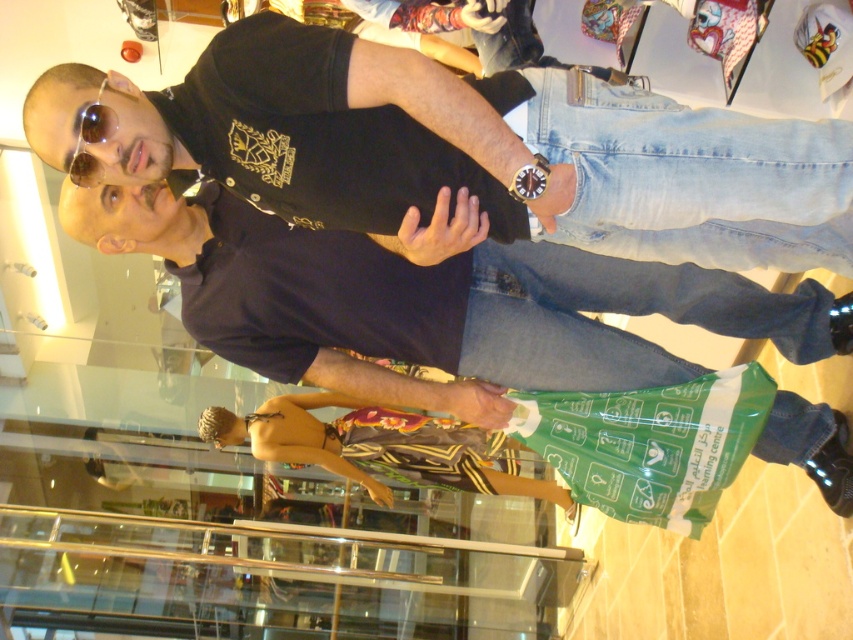
You are a store employee and need to arrange the black matte shirt at upper center and the matte black shirt at center on a hanger rack. According to the image, which shirt should be placed lower on the rack to match the original display?

The black matte shirt at upper center should be placed lower on the rack because it has a lesser height compared to the matte black shirt at center, so positioning the shorter one lower would replicate the original display.

You are a store manager checking the display. You see the black matte shirt at upper center and the matte black shirt at center. Which one is wider?

The matte black shirt at center is wider than the black matte shirt at upper center.

You are a customer trying to find the largest shirt in the store. You see the black matte shirt at upper center and the matte black shirt at center. Which one should you choose?

The matte black shirt at center is larger than the black matte shirt at upper center, so you should choose the matte black shirt at center.